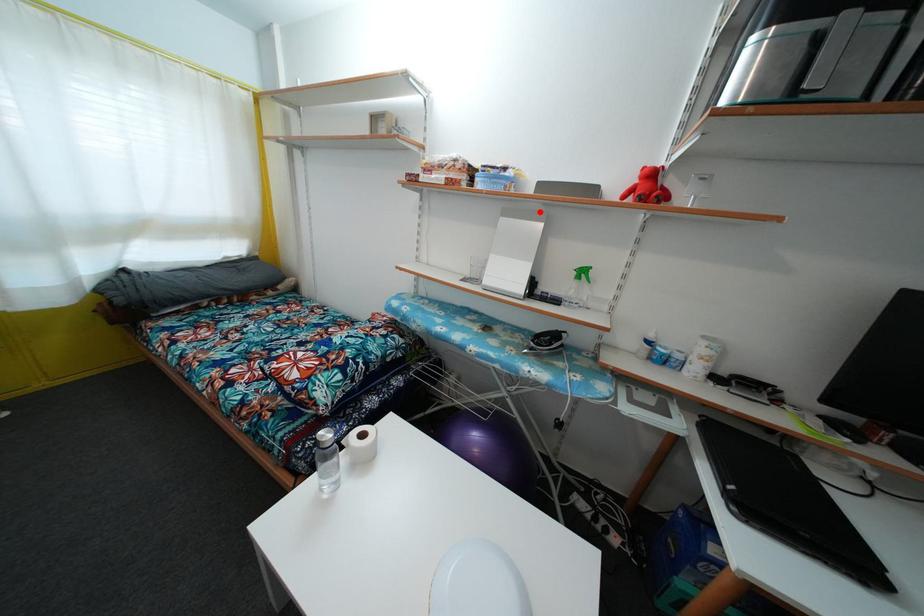
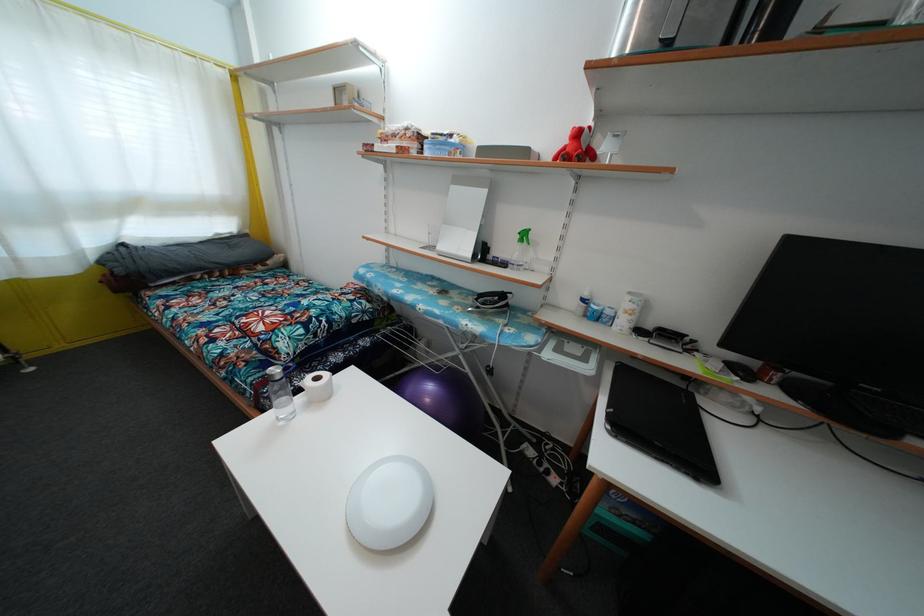
Where in the second image is the point corresponding to the highlighted location from the first image?

(488, 177)